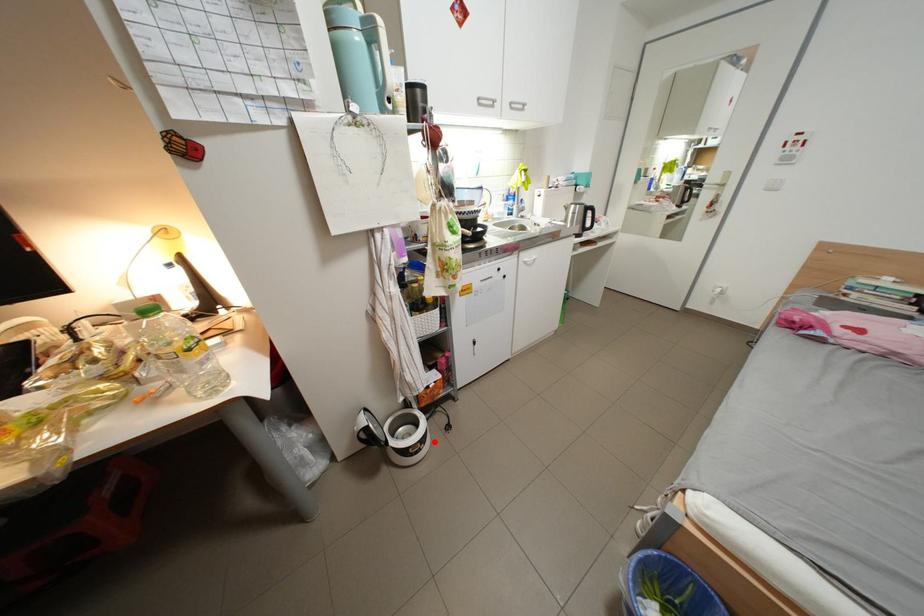
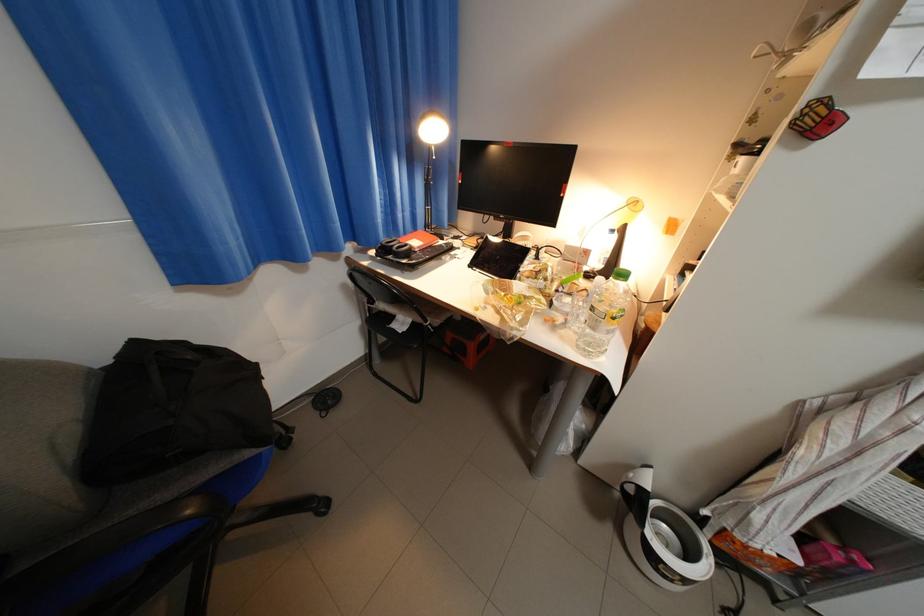
Find the pixel in the second image that matches the highlighted location in the first image.

(698, 582)